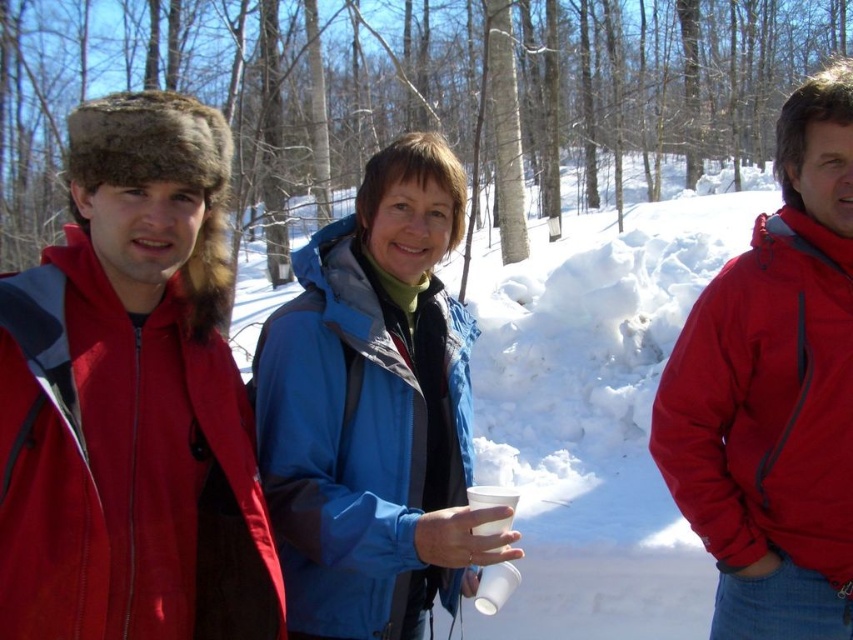
You are a photographer planning to take a group photo of the blue softshell jacket at center and the matte red jacket at right. Since you want to ensure both jackets are clearly visible, which jacket should you focus on first to adjust the camera settings for optimal clarity?

The blue softshell jacket at center is larger in size than the matte red jacket at right, so you should focus on the blue softshell jacket at center first to adjust the camera settings for optimal clarity.

You are planning to take a winter hike and need to decide which item to pack first between the fuzzy fur hat at left and the matte red jacket at right. Based on their sizes, which one might require more storage space in your backpack?

The matte red jacket at right is taller than the fuzzy fur hat at left, so it might require more storage space in your backpack.

You are planning to take a winter hike and need to decide between the fuzzy fur hat at left and the blue softshell jacket at center for warmth. Based on their thickness, which one would provide better insulation?

The blue softshell jacket at center is thicker than the fuzzy fur hat at left, so it would provide better insulation for the winter hike.